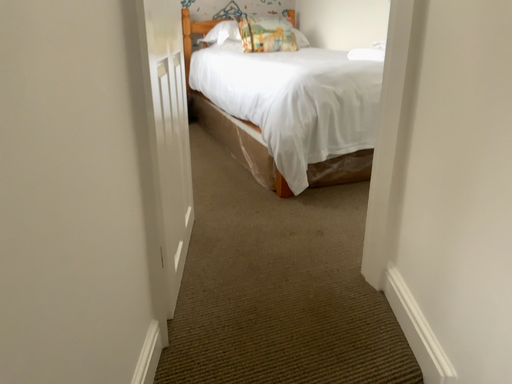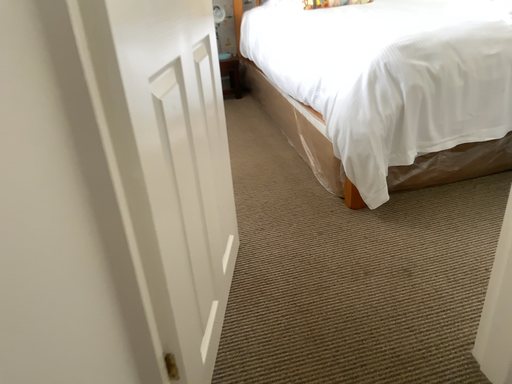
Question: Which way did the camera rotate in the video?

Choices:
 (A) rotated right
 (B) rotated left

Answer: (B)